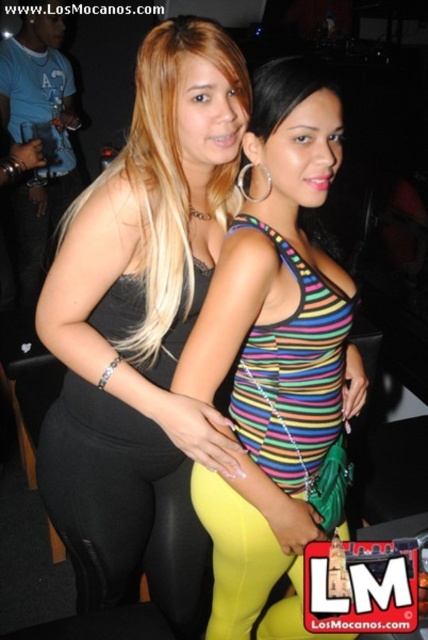
You are standing at point (158, 609) and want to take a photo of the two women in the scene. If your camera is 1.40 meters away from you, will it be able to capture both women in the frame?

The point (158, 609) and camera are 1.40 meters apart from each other, so yes, the camera can capture both women in the frame since they are positioned at the same distance as the camera.

You are a photographer trying to capture a clear shot of both the black leggings at center and the yellow spandex leggings at lower center. Since you want to focus on the smaller one, which leggings should you adjust your camera to zoom in on?

The yellow spandex leggings at lower center is smaller in size than the black leggings at center, so you should zoom in on the yellow spandex leggings at lower center to focus on the smaller one.